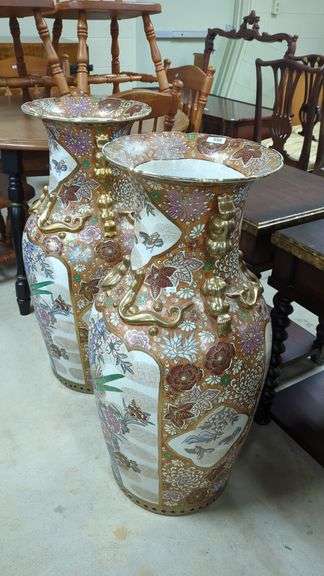
At what (x,y) coordinates should I click in order to perform the action: click on wall. Please return your answer as a coordinate pair (x, y). The image size is (324, 576). Looking at the image, I should click on (304, 21).